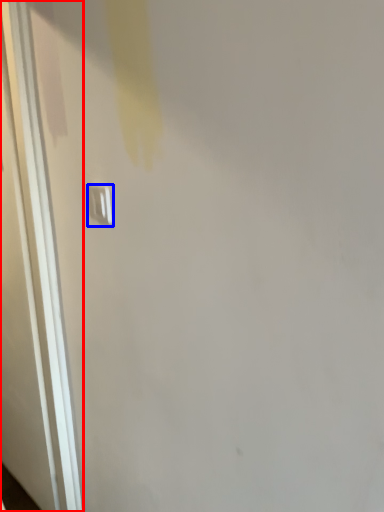
Question: Which of the following is the closest to the observer, door (highlighted by a red box) or light switch (highlighted by a blue box)?

Choices:
 (A) door
 (B) light switch

Answer: (B)